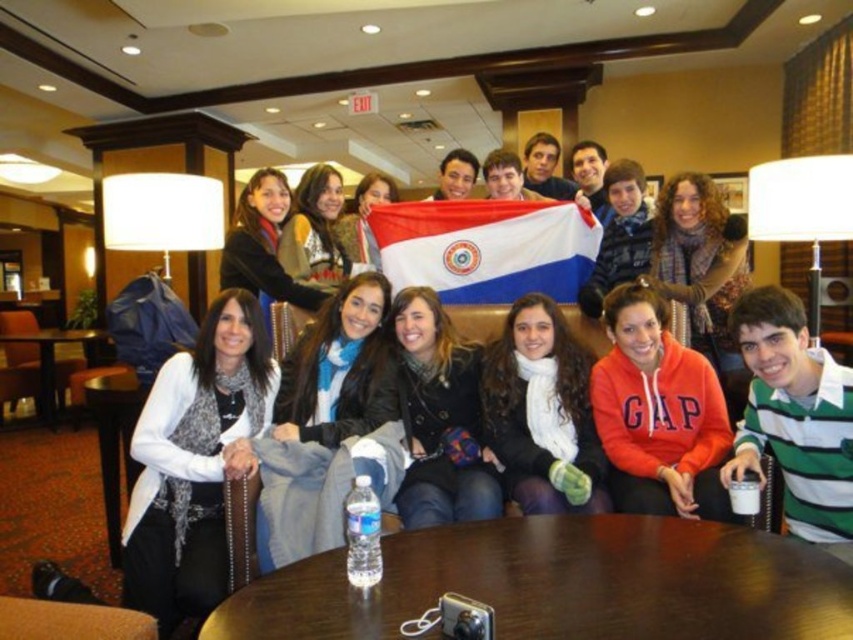
You are standing in the hotel lobby and want to place a small potted plant on the brown wooden table at center. The table is represented by the point coordinates point (561, 582). Can you confirm if the table is large enough to accommodate the plant?

The point (561, 582) indicates the brown wooden table at center, which is a valid location to place the small potted plant as it is a table and typically has space for such items.

You are standing in the hotel lobby and want to place a large potted plant on the nearest brown wooden table. Which table should you choose between the brown wooden table at center and the brown wooden table at lower left?

The brown wooden table at center is closer to you, so you should place the plant there.